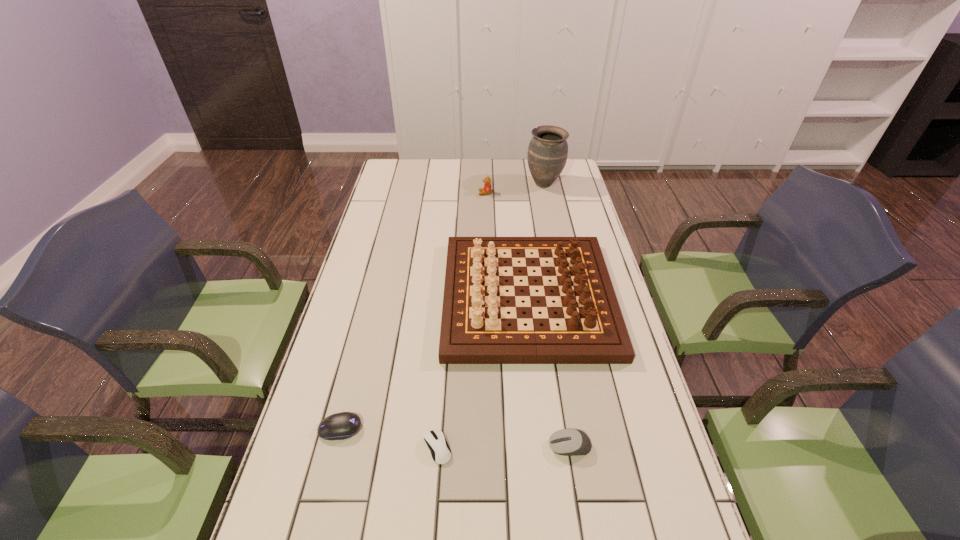
Identify the location of urn. click(547, 154).

You are a GUI agent. You are given a task and a screenshot of the screen. Output one action in this format:
    pyautogui.click(x=<x>, y=<y>)
    Task: Click on the third farthest object
    This screenshot has width=960, height=540.
    Given the screenshot: What is the action you would take?
    click(x=474, y=326)

At what (x,y) coordinates should I click in order to perform the action: click on gameboard. Please return your answer as a coordinate pair (x, y). Looking at the image, I should click on (474, 326).

At what (x,y) coordinates should I click in order to perform the action: click on teddy bear. Please return your answer as a coordinate pair (x, y). The image size is (960, 540). Looking at the image, I should click on (487, 186).

The image size is (960, 540). I want to click on the rightmost mouse, so click(568, 442).

Locate an element on the screen. Image resolution: width=960 pixels, height=540 pixels. the leftmost object is located at coordinates (339, 426).

I want to click on the second mouse from right to left, so click(440, 451).

What are the coordinates of `blank space located on the left of the urn` in the screenshot? It's located at (464, 184).

Find the location of a particular element. free spot located on the side with the white pieces of the gameboard is located at coordinates (376, 297).

Identify the location of vacant area situated on the side with the white pieces of the gameboard. This screenshot has height=540, width=960. (398, 297).